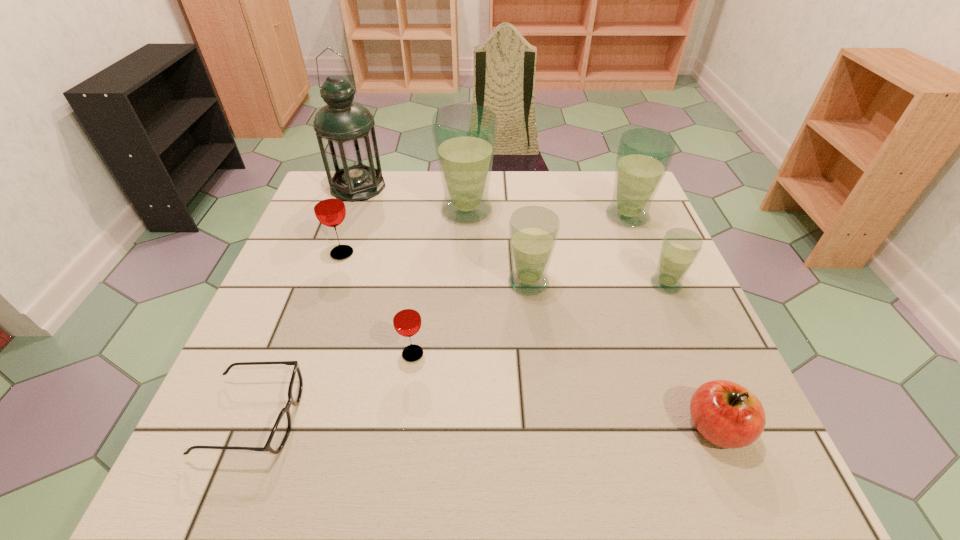
Locate which object ranks seventh in proximity to the green oil lamp. Please provide its 2D coordinates. Your answer should be formatted as a tuple, i.e. [(x, y)], where the tuple contains the x and y coordinates of a point satisfying the conditions above.

[(680, 247)]

Locate which object is the fifth closest to the oil lamp. Please provide its 2D coordinates. Your answer should be formatted as a tuple, i.e. [(x, y)], where the tuple contains the x and y coordinates of a point satisfying the conditions above.

[(280, 432)]

This screenshot has width=960, height=540. I want to click on the fifth closest glass to the tallest glass, so click(680, 247).

The height and width of the screenshot is (540, 960). What are the coordinates of `glass that stands as the third closest to the seventh shortest object` in the screenshot? It's located at (464, 135).

Locate which blue glass ranks second in proximity to the red apple. Please provide its 2D coordinates. Your answer should be formatted as a tuple, i.e. [(x, y)], where the tuple contains the x and y coordinates of a point satisfying the conditions above.

[(533, 230)]

Identify which blue glass is located as the nearest to the third tallest object. Please provide its 2D coordinates. Your answer should be formatted as a tuple, i.e. [(x, y)], where the tuple contains the x and y coordinates of a point satisfying the conditions above.

[(680, 247)]

The width and height of the screenshot is (960, 540). I want to click on vacant region that satisfies the following two spatial constraints: 1. on the front side of the nearest glass; 2. on the front-facing side of the shortest object, so click(x=404, y=417).

I want to click on vacant space that satisfies the following two spatial constraints: 1. on the back side of the seventh farthest object; 2. on the right side of the leftmost blue glass, so click(x=432, y=211).

You are a GUI agent. You are given a task and a screenshot of the screen. Output one action in this format:
    pyautogui.click(x=<x>, y=<y>)
    Task: Click on the vacant position in the image that satisfies the following two spatial constraints: 1. on the front side of the nearest glass; 2. on the left side of the left red glass
    
    Given the screenshot: What is the action you would take?
    pyautogui.click(x=307, y=354)